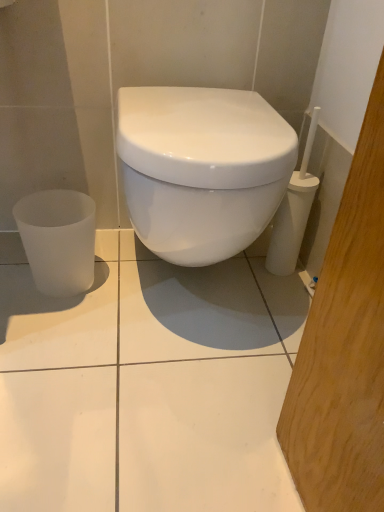
You are a GUI agent. You are given a task and a screenshot of the screen. Output one action in this format:
    pyautogui.click(x=<x>, y=<y>)
    Task: Click on the white glossy toilet at center
    This screenshot has width=384, height=512.
    Given the screenshot: What is the action you would take?
    pyautogui.click(x=202, y=169)

The height and width of the screenshot is (512, 384). Describe the element at coordinates (202, 169) in the screenshot. I see `white glossy toilet at center` at that location.

This screenshot has height=512, width=384. What do you see at coordinates (58, 240) in the screenshot?
I see `frosted glass cup at lower left` at bounding box center [58, 240].

This screenshot has width=384, height=512. I want to click on frosted glass cup at lower left, so click(x=58, y=240).

What is the approximate width of frosted glass cup at lower left?

frosted glass cup at lower left is 21.93 centimeters wide.

You are a GUI agent. You are given a task and a screenshot of the screen. Output one action in this format:
    pyautogui.click(x=<x>, y=<y>)
    Task: Click on the white glossy toilet at center
    
    Given the screenshot: What is the action you would take?
    pyautogui.click(x=202, y=169)

Does frosted glass cup at lower left appear on the right side of white glossy toilet at center?

No, frosted glass cup at lower left is not to the right of white glossy toilet at center.

Is frosted glass cup at lower left further to camera compared to white glossy toilet at center?

Yes, it is.

Does point (64, 287) come behind point (218, 238)?

That is True.

From the image's perspective, is frosted glass cup at lower left over white glossy toilet at center?

No, from the image's perspective, frosted glass cup at lower left is not above white glossy toilet at center.

From a real-world perspective, which is physically below, frosted glass cup at lower left or white glossy toilet at center?

In real-world perspective, frosted glass cup at lower left is lower.

Is frosted glass cup at lower left wider than white glossy toilet at center?

No.

Considering the sizes of objects frosted glass cup at lower left and white glossy toilet at center in the image provided, who is shorter, frosted glass cup at lower left or white glossy toilet at center?

Standing shorter between the two is frosted glass cup at lower left.

Based on their sizes in the image, would you say frosted glass cup at lower left is bigger or smaller than white glossy toilet at center?

Clearly, frosted glass cup at lower left is smaller in size than white glossy toilet at center.

Is frosted glass cup at lower left positioned beyond the bounds of white glossy toilet at center?

Yes, frosted glass cup at lower left is located beyond the bounds of white glossy toilet at center.

Is frosted glass cup at lower left far away from white glossy toilet at center?

No, frosted glass cup at lower left is in close proximity to white glossy toilet at center.

Is frosted glass cup at lower left positioned with its back to white glossy toilet at center?

That's not correct — frosted glass cup at lower left is not looking away from white glossy toilet at center.

Can you tell me how much frosted glass cup at lower left and white glossy toilet at center differ in facing direction?

There is a 1.16-degree angle between the facing directions of frosted glass cup at lower left and white glossy toilet at center.

How much distance is there between frosted glass cup at lower left and white glossy toilet at center?

13.75 inches.

This screenshot has width=384, height=512. I want to click on porcelain behind the white glossy toilet at center, so click(58, 240).

Does white glossy toilet at center appear on the left side of frosted glass cup at lower left?

No, white glossy toilet at center is not to the left of frosted glass cup at lower left.

Which is in front, white glossy toilet at center or frosted glass cup at lower left?

white glossy toilet at center.

Which is behind, point (221, 218) or point (45, 224)?

The point (45, 224) is farther.

From the image's perspective, is white glossy toilet at center located above frosted glass cup at lower left?

Yes, from the image's perspective, white glossy toilet at center is above frosted glass cup at lower left.

From a real-world perspective, is white glossy toilet at center above or below frosted glass cup at lower left?

white glossy toilet at center is situated higher than frosted glass cup at lower left in the real world.

Between white glossy toilet at center and frosted glass cup at lower left, which one has larger width?

white glossy toilet at center.

Considering the relative sizes of white glossy toilet at center and frosted glass cup at lower left in the image provided, is white glossy toilet at center shorter than frosted glass cup at lower left?

In fact, white glossy toilet at center may be taller than frosted glass cup at lower left.

Considering the sizes of white glossy toilet at center and frosted glass cup at lower left in the image, is white glossy toilet at center bigger or smaller than frosted glass cup at lower left?

Clearly, white glossy toilet at center is larger in size than frosted glass cup at lower left.

Is white glossy toilet at center completely or partially outside of frosted glass cup at lower left?

white glossy toilet at center is positioned outside frosted glass cup at lower left.

Can you see white glossy toilet at center touching frosted glass cup at lower left?

white glossy toilet at center is not next to frosted glass cup at lower left, and they're not touching.

Consider the image. Could you tell me if white glossy toilet at center is facing frosted glass cup at lower left?

No, white glossy toilet at center is not aimed at frosted glass cup at lower left.

What's the angular difference between white glossy toilet at center and frosted glass cup at lower left's facing directions?

1.16 degrees.

How distant is white glossy toilet at center from frosted glass cup at lower left?

A distance of 13.75 inches exists between white glossy toilet at center and frosted glass cup at lower left.

Where is `toilet in front of the frosted glass cup at lower left`? Image resolution: width=384 pixels, height=512 pixels. toilet in front of the frosted glass cup at lower left is located at coordinates (202, 169).

Image resolution: width=384 pixels, height=512 pixels. Find the location of `porcelain on the left of white glossy toilet at center`. porcelain on the left of white glossy toilet at center is located at coordinates (58, 240).

Locate an element on the screen. The width and height of the screenshot is (384, 512). toilet above the frosted glass cup at lower left (from the image's perspective) is located at coordinates (202, 169).